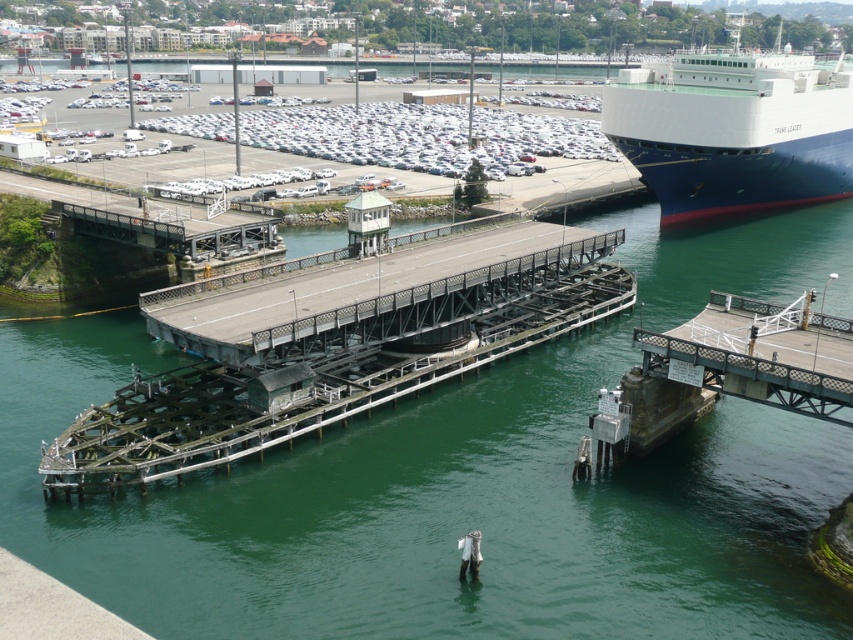
Which of these two, greenish metallic bridge at center or blue polished steel ship at right, stands taller?

blue polished steel ship at right is taller.

How much distance is there between greenish metallic bridge at center and blue polished steel ship at right?

greenish metallic bridge at center is 43.42 meters away from blue polished steel ship at right.

At what (x,y) coordinates should I click in order to perform the action: click on greenish metallic bridge at center. Please return your answer as a coordinate pair (x, y). The width and height of the screenshot is (853, 640). Looking at the image, I should click on (334, 342).